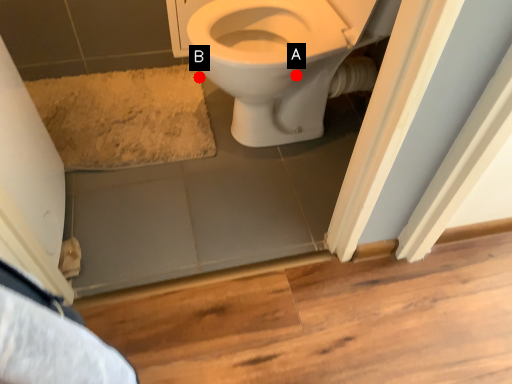
Question: Two points are circled on the image, labeled by A and B beside each circle. Among these points, which one is nearest to the camera?

Choices:
 (A) A is closer
 (B) B is closer

Answer: (A)